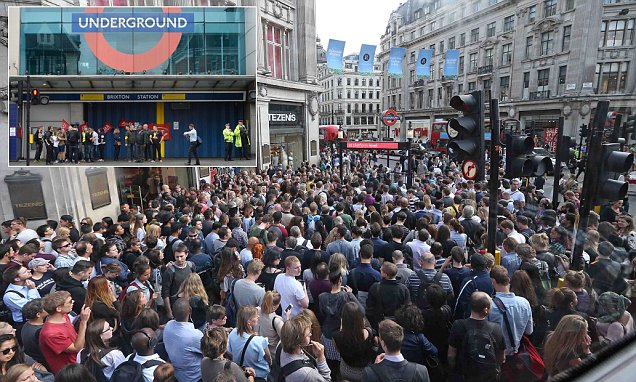
What are the coordinates of `red window coverings` in the screenshot? It's located at (279, 56), (272, 47), (279, 35), (270, 28).